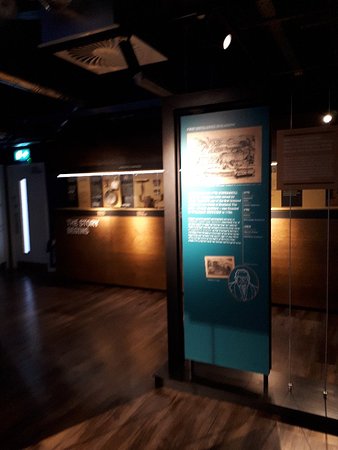
Image resolution: width=338 pixels, height=450 pixels. What are the coordinates of `wall under the main exhibit` in the screenshot? It's located at (79, 268), (110, 233), (152, 280), (157, 230), (281, 239), (280, 294), (306, 292), (308, 253).